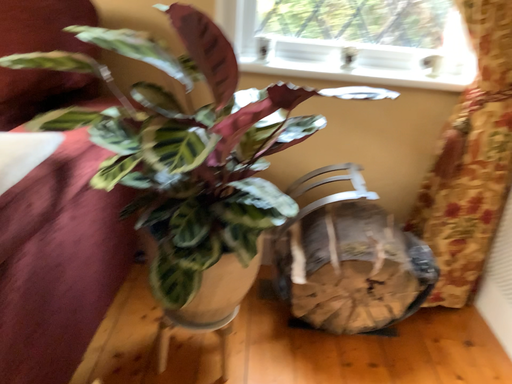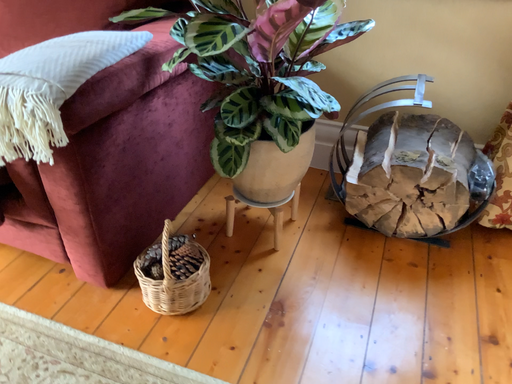
Question: How did the camera likely rotate when shooting the video?

Choices:
 (A) rotated left
 (B) rotated right

Answer: (A)